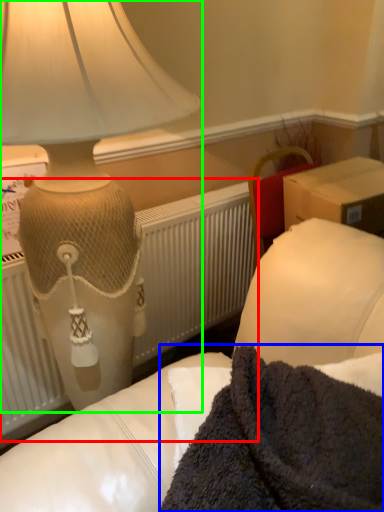
Question: Estimate the real-world distances between objects in this image. Which object is closer to radiator (highlighted by a red box), blanket (highlighted by a blue box) or lamp (highlighted by a green box)?

Choices:
 (A) blanket
 (B) lamp

Answer: (B)